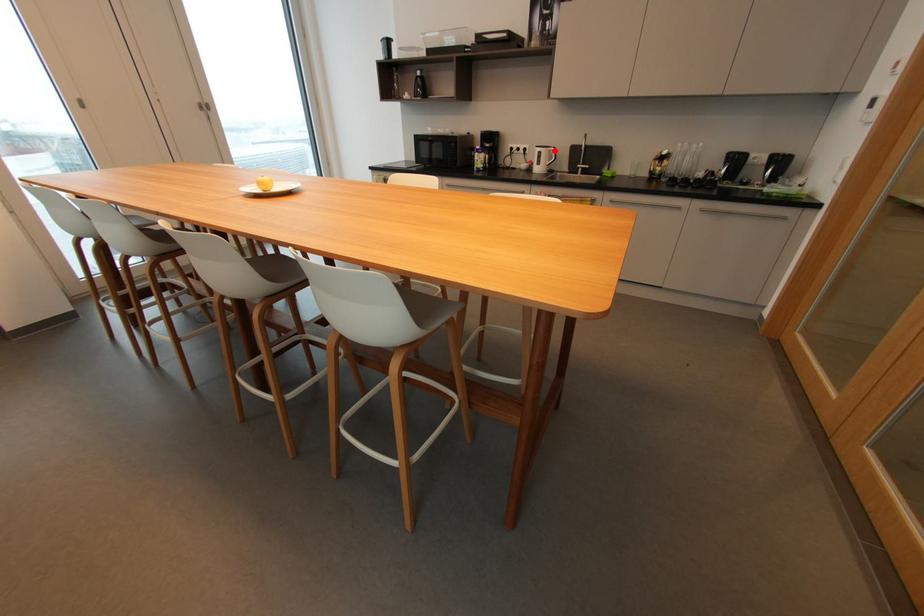
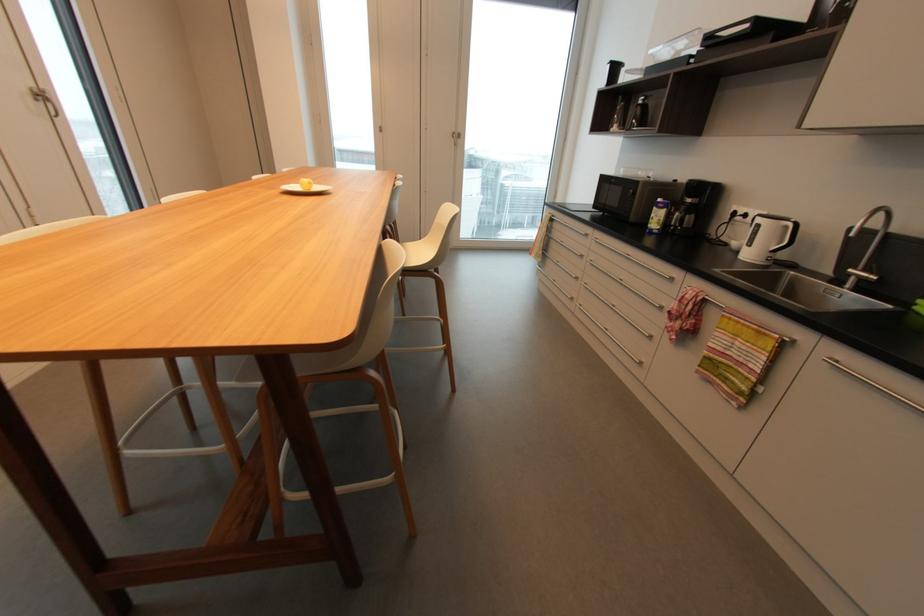
Question: I am providing you with two images of the same scene from different viewpoints. In image1, a red point is highlighted. Considering the same 3D point in image2, which of the following is correct?

Choices:
 (A) It is closer
 (B) It is farther

Answer: (B)